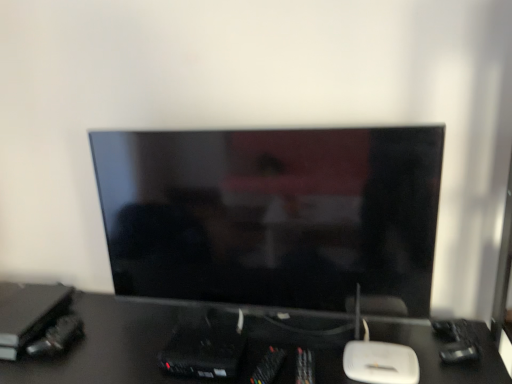
Question: Can you confirm if matte black monitor at center is shorter than black glossy desk at center?

Choices:
 (A) yes
 (B) no

Answer: (B)

Question: Is matte black monitor at center positioned behind black glossy desk at center?

Choices:
 (A) no
 (B) yes

Answer: (B)

Question: From the image's perspective, is matte black monitor at center on top of black glossy desk at center?

Choices:
 (A) no
 (B) yes

Answer: (B)

Question: Considering the relative positions of matte black monitor at center and black glossy desk at center in the image provided, is matte black monitor at center to the right of black glossy desk at center from the viewer's perspective?

Choices:
 (A) no
 (B) yes

Answer: (B)

Question: Can we say matte black monitor at center lies outside black glossy desk at center?

Choices:
 (A) no
 (B) yes

Answer: (B)

Question: Considering the relative sizes of matte black monitor at center and black glossy desk at center in the image provided, is matte black monitor at center smaller than black glossy desk at center?

Choices:
 (A) yes
 (B) no

Answer: (A)

Question: Is black glossy desk at center shorter than matte black monitor at center?

Choices:
 (A) yes
 (B) no

Answer: (A)

Question: Does black glossy desk at center lie in front of matte black monitor at center?

Choices:
 (A) yes
 (B) no

Answer: (A)

Question: From a real-world perspective, is black glossy desk at center positioned under matte black monitor at center based on gravity?

Choices:
 (A) no
 (B) yes

Answer: (B)

Question: Does black glossy desk at center appear on the left side of matte black monitor at center?

Choices:
 (A) yes
 (B) no

Answer: (A)

Question: Would you say black glossy desk at center is a long distance from matte black monitor at center?

Choices:
 (A) yes
 (B) no

Answer: (B)

Question: Would you say matte black monitor at center is part of black glossy desk at center's contents?

Choices:
 (A) yes
 (B) no

Answer: (B)

Question: Would you say black glossy desk at center is inside or outside matte black monitor at center?

Choices:
 (A) inside
 (B) outside

Answer: (B)